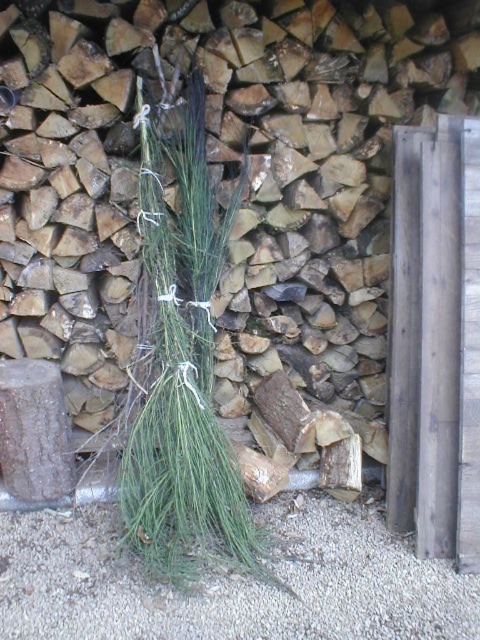
Question: In this image, where is green grass bundle at center located relative to green grass at center?

Choices:
 (A) below
 (B) above

Answer: (B)

Question: Which object is closer to the camera taking this photo?

Choices:
 (A) green grass bundle at center
 (B) gray gravel at lower center

Answer: (B)

Question: Does green grass bundle at center lie in front of gray gravel at lower center?

Choices:
 (A) yes
 (B) no

Answer: (B)

Question: Which point is closer to the camera?

Choices:
 (A) (13, 592)
 (B) (159, 348)

Answer: (A)

Question: Which object is closer to the camera taking this photo?

Choices:
 (A) gray gravel at lower center
 (B) green grass bundle at center
 (C) green grass at center

Answer: (A)

Question: Is gray gravel at lower center bigger than green grass at center?

Choices:
 (A) no
 (B) yes

Answer: (A)